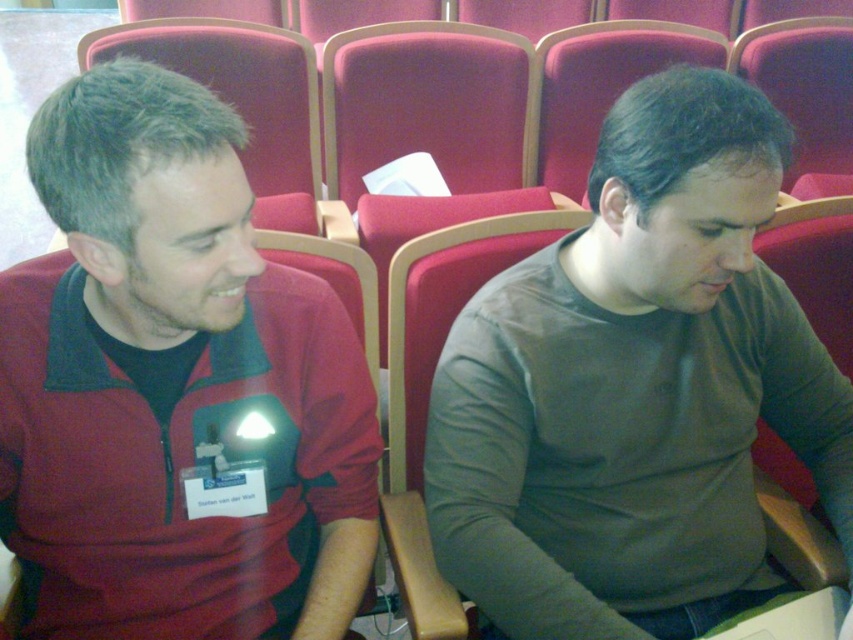
You are organizing a photo shoot and need to place a small prop between the matte red jacket at left and the matte gray shirt at center. Based on their sizes, which object should the prop be closer to?

The matte red jacket at left is smaller than the matte gray shirt at center, so the prop should be placed closer to the matte red jacket at left to maintain balance between the two objects.

You are standing in the auditorium and want to reach the point marked as point (x=24, y=362). If your walking space is limited to 30 inches, will you be able to reach that point comfortably?

The distance between you and point (x=24, y=362) is 34.43 inches, which exceeds your 30 inches walking space limit. Therefore, you won

You are a photographer trying to capture a clear shot of the matte gray shirt at center without the matte red jacket at left blocking it. Is this possible given their current positions?

The matte red jacket at left is positioned over the matte gray shirt at center, so it is blocking the view. You cannot capture a clear shot of the matte gray shirt at center without the matte red jacket at left blocking it.